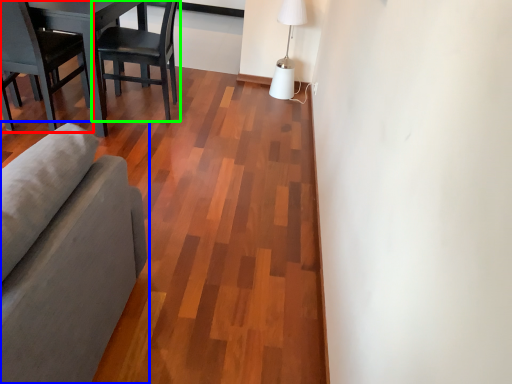
Question: Which object is the farthest from chair (highlighted by a red box)? Choose among these: studio couch (highlighted by a blue box) or chair (highlighted by a green box).

Choices:
 (A) studio couch
 (B) chair

Answer: (A)